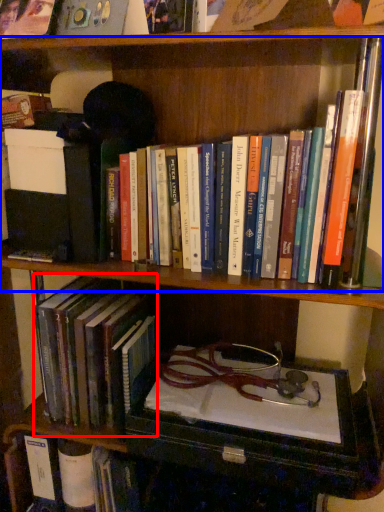
Question: Which point is closer to the camera, book (highlighted by a red box) or book (highlighted by a blue box)?

Choices:
 (A) book
 (B) book

Answer: (B)